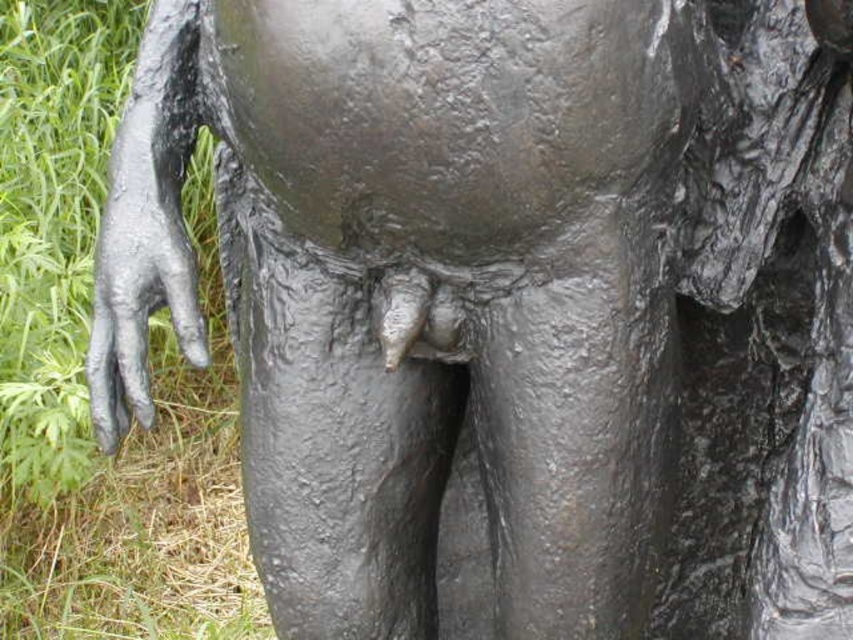
You are an art conservator examining the sculpture. You notice two points on the sculpture marked at coordinates point (x=45, y=596) and point (x=102, y=436). Which point is closer to the viewer?

Point (x=102, y=436) is closer to the viewer than point (x=45, y=596) because the description states that point (x=45, y=596) is behind point (x=102, y=436).

You are a photographer trying to capture the sculpture. You notice the green grass at left and the shiny black hand at left in your frame. Which object should you focus on if you want to highlight something that takes up more space in the image?

The green grass at left is larger in size than the shiny black hand at left, so you should focus on the green grass at left to highlight the object that takes up more space in the image.

You are an artist analyzing the sculpture and want to place a small marker at the exact center of the green grass at left. According to the coordinates provided, what are the coordinates where you should place the marker?

The coordinates for the green grass at left are at point (83, 371), so you should place the marker at those coordinates.